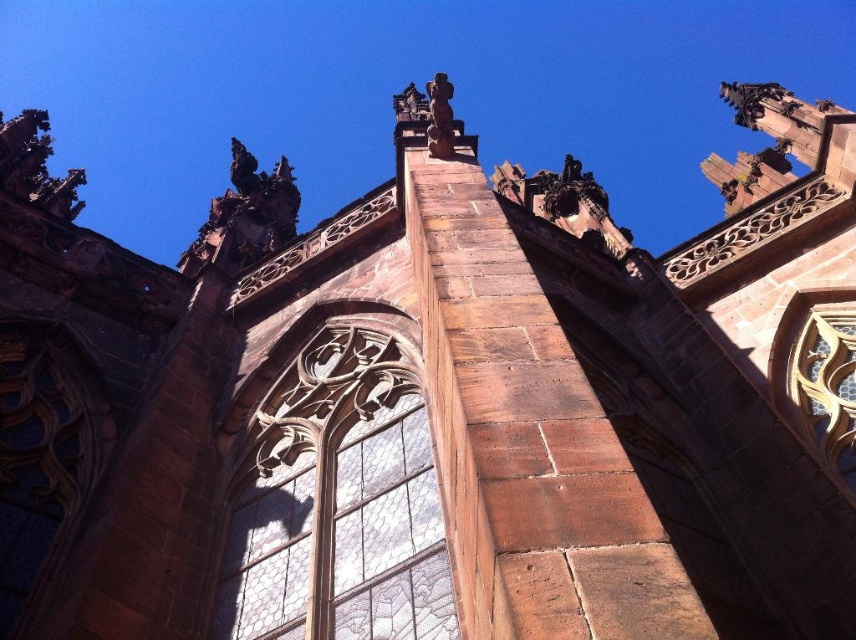
Question: Considering the relative positions of clear glass window at center and clear glass window at upper right in the image provided, where is clear glass window at center located with respect to clear glass window at upper right?

Choices:
 (A) left
 (B) right

Answer: (A)

Question: Which point is farther to the camera?

Choices:
 (A) clear glass window at center
 (B) clear glass window at upper right

Answer: (B)

Question: Which object is closer to the camera taking this photo?

Choices:
 (A) clear glass window at center
 (B) clear glass window at upper right

Answer: (A)

Question: In this image, where is clear glass window at center located relative to clear glass window at upper right?

Choices:
 (A) left
 (B) right

Answer: (A)

Question: Does clear glass window at center have a greater width compared to clear glass window at upper right?

Choices:
 (A) no
 (B) yes

Answer: (B)

Question: Which point is farther from the camera taking this photo?

Choices:
 (A) 815,378
 (B) 295,522

Answer: (A)